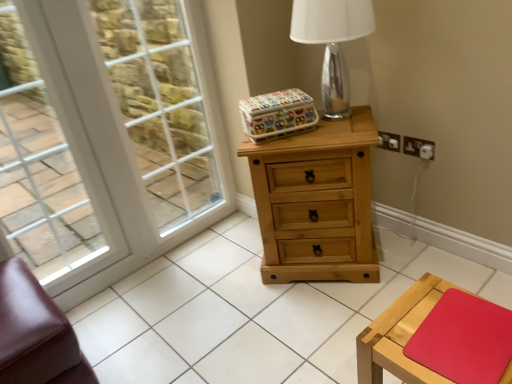
Locate an element on the screen. empty space that is ontop of wooden table at lower right is located at coordinates (448, 332).